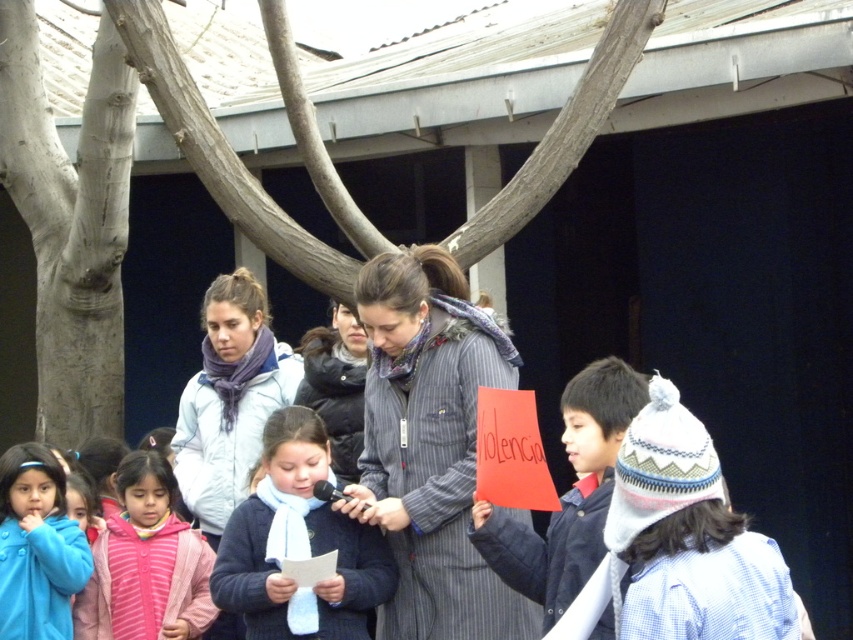
You are standing at the point with coordinates point [267,419] and want to walk towards the point [715,504]. According to the scene, will you be walking towards or away from the young girl holding the paper and speaking into the microphone?

Point [715,504] is in front of point [267,419]. Since you are starting at point [267,419] and walking toward point [715,504], you will be moving towards the young girl holding the paper and speaking into the microphone because the destination point is in front of your starting position.

You are a photographer taking a picture of the children and adults under the large tree. You notice the smooth white bark at center and the dark blue sweater at center. Which object should you focus on first if you want to capture both in the frame without moving the camera?

The smooth white bark at center is positioned on the left side of dark blue sweater at center, so you should focus on the smooth white bark at center first to ensure both are in the frame without moving the camera.

You are organizing a school play and need to arrange seating so that the tallest object is placed at the back to avoid blocking views. Which object should be placed at the back between the white knitted hat at lower right and the light blue jacket at center?

The light blue jacket at center should be placed at the back because it is taller than the white knitted hat at lower right.